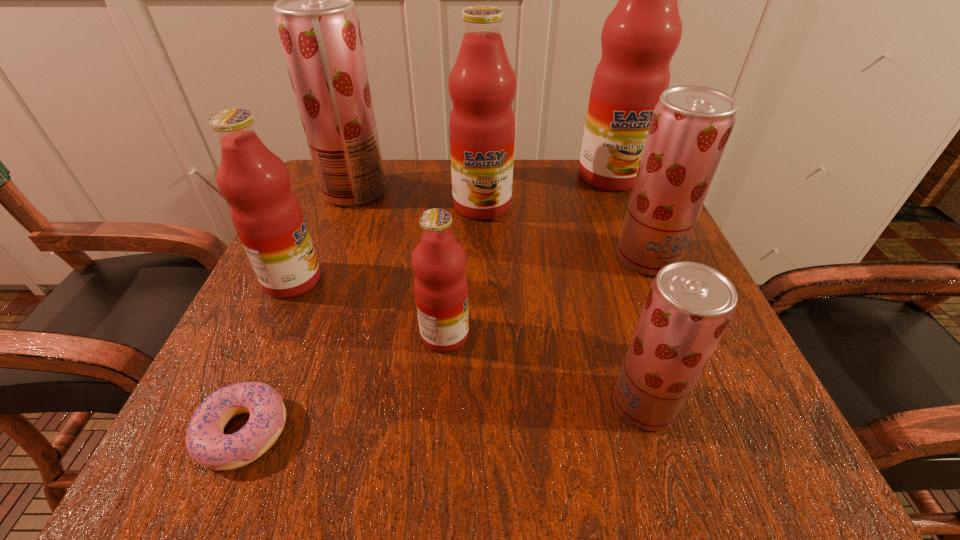
Find the location of `the tallest object`. the tallest object is located at coordinates (639, 37).

The width and height of the screenshot is (960, 540). Identify the location of the biggest pink fruit juice. (639, 37).

This screenshot has height=540, width=960. What are the coordinates of `the farthest strawberry fruit juice` in the screenshot? It's located at (318, 28).

I want to click on the leftmost strawberry fruit juice, so click(318, 28).

This screenshot has width=960, height=540. What are the coordinates of `the second biggest pink fruit juice` in the screenshot? It's located at (482, 84).

I want to click on the second nearest strawberry fruit juice, so click(x=690, y=127).

Identify the location of the leftmost pink fruit juice. (267, 216).

Image resolution: width=960 pixels, height=540 pixels. Identify the location of the second smallest pink fruit juice. [267, 216].

Locate an element on the screen. the smallest pink fruit juice is located at coordinates (440, 285).

At what (x,y) coordinates should I click in order to perform the action: click on the sixth farthest fruit juice. Please return your answer as a coordinate pair (x, y). The image size is (960, 540). Looking at the image, I should click on (440, 285).